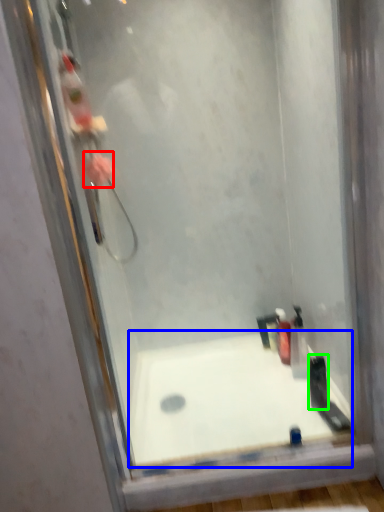
Question: Estimate the real-world distances between objects in this image. Which object is closer to flower (highlighted by a red box), bathtub (highlighted by a blue box) or toiletry (highlighted by a green box)?

Choices:
 (A) bathtub
 (B) toiletry

Answer: (A)